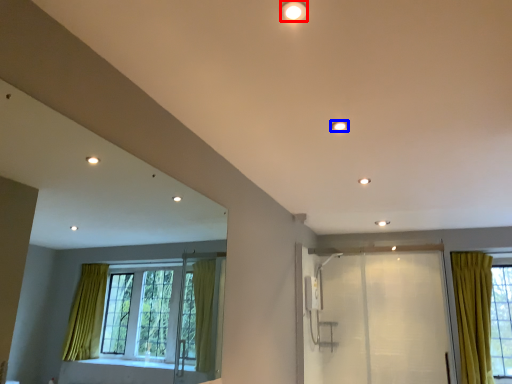
Question: Which point is closer to the camera, lighting (highlighted by a red box) or lighting (highlighted by a blue box)?

Choices:
 (A) lighting
 (B) lighting

Answer: (A)